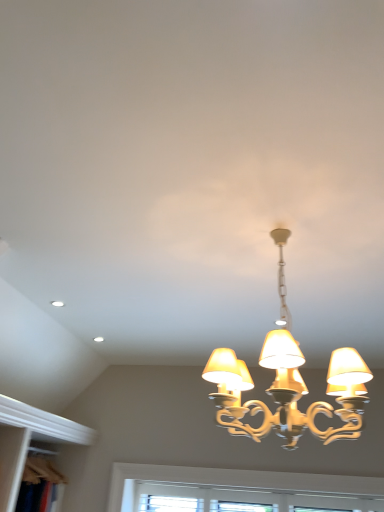
Question: Is gold metallic chandelier at center wider or thinner than white textured window at lower center?

Choices:
 (A) wide
 (B) thin

Answer: (A)

Question: Considering the relative positions of gold metallic chandelier at center and white textured window at lower center in the image provided, is gold metallic chandelier at center to the left or to the right of white textured window at lower center?

Choices:
 (A) right
 (B) left

Answer: (B)

Question: Which of these objects is positioned farthest from the gold metallic chandelier at center?

Choices:
 (A) white textured window at lower center
 (B) wooden bookshelf at lower left

Answer: (B)

Question: Estimate the real-world distances between objects in this image. Which object is farther from the white textured window at lower center?

Choices:
 (A) wooden bookshelf at lower left
 (B) gold metallic chandelier at center

Answer: (A)